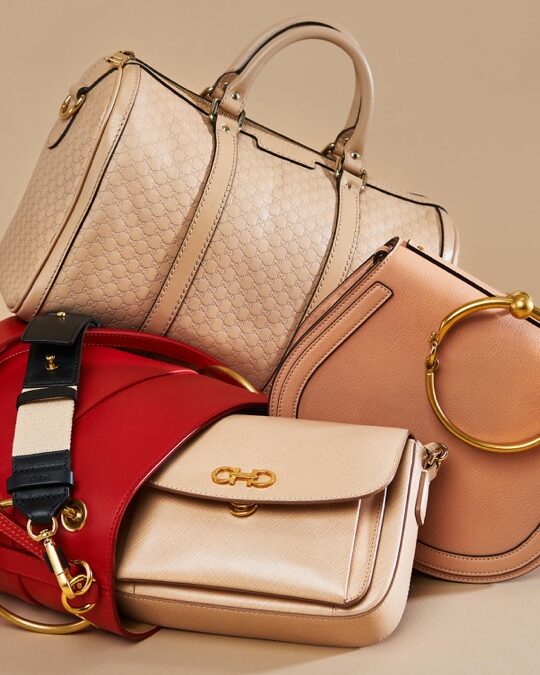
Image resolution: width=540 pixels, height=675 pixels. What are the coordinates of `handle` in the screenshot? It's located at click(x=272, y=43).